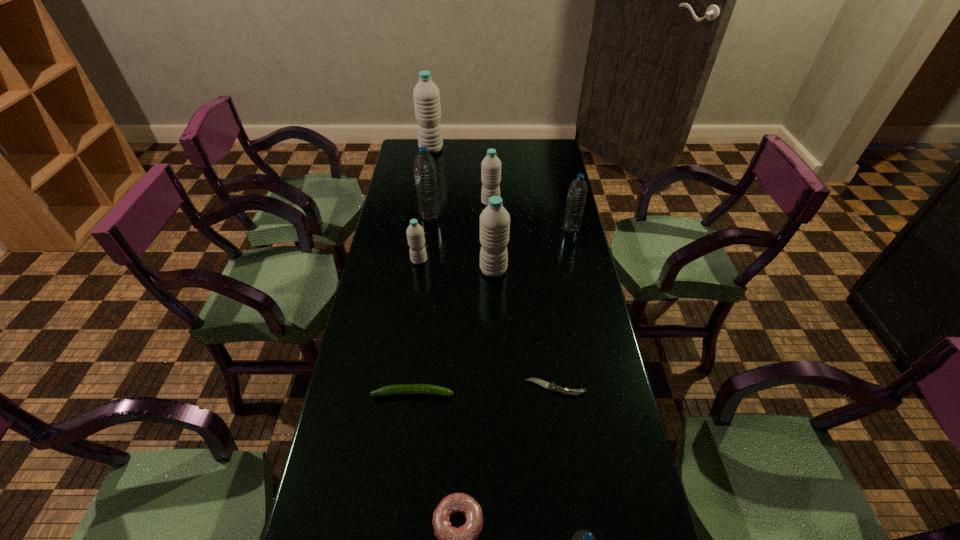
Where is `white water bottle that stands as the third closest to the smallest white water bottle`? This screenshot has width=960, height=540. white water bottle that stands as the third closest to the smallest white water bottle is located at coordinates (426, 94).

Select which blue water bottle appears as the closest to the ninth nearest object. Please provide its 2D coordinates. Your answer should be formatted as a tuple, i.e. [(x, y)], where the tuple contains the x and y coordinates of a point satisfying the conditions above.

[(425, 172)]

I want to click on blue water bottle identified as the third closest to the pocketknife, so click(x=425, y=172).

Locate an element on the screen. The image size is (960, 540). vacant region that satisfies the following two spatial constraints: 1. on the back side of the smallest white water bottle; 2. on the left side of the second farthest water bottle is located at coordinates (427, 203).